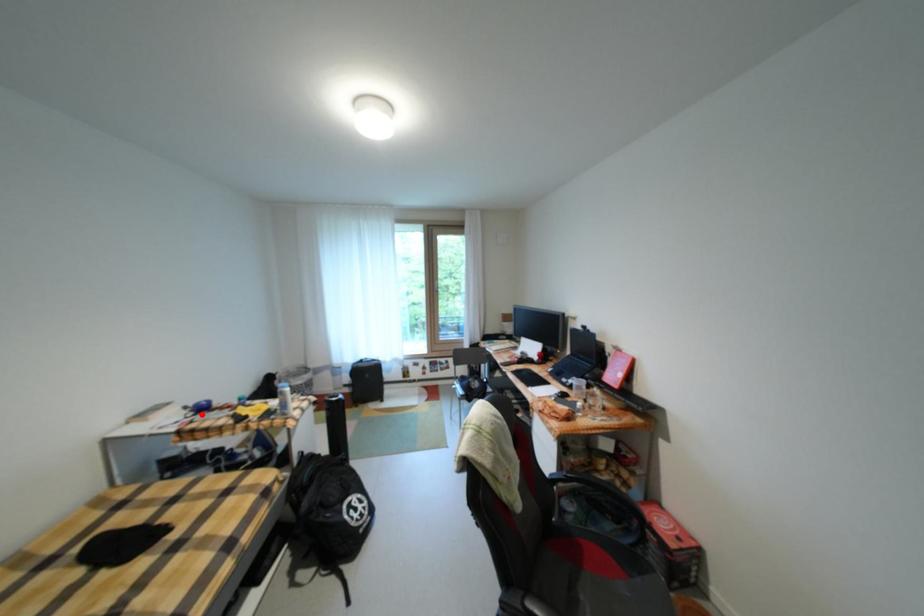
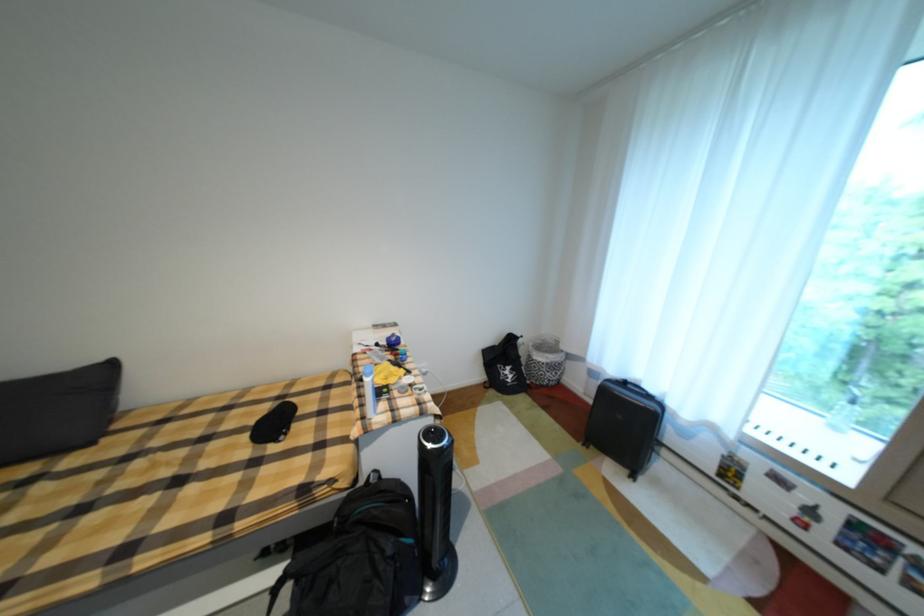
In the second image, find the point that corresponds to the highlighted location in the first image.

(394, 344)